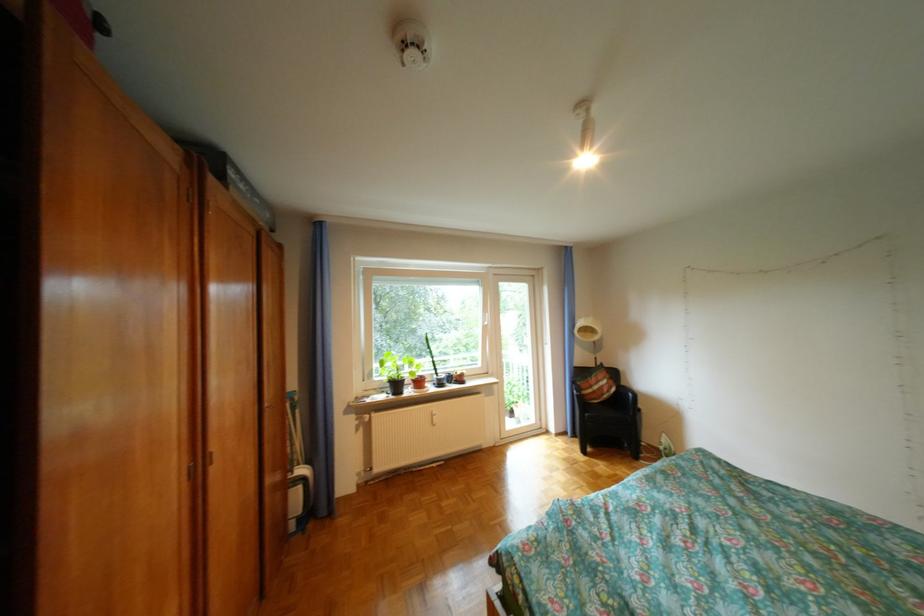
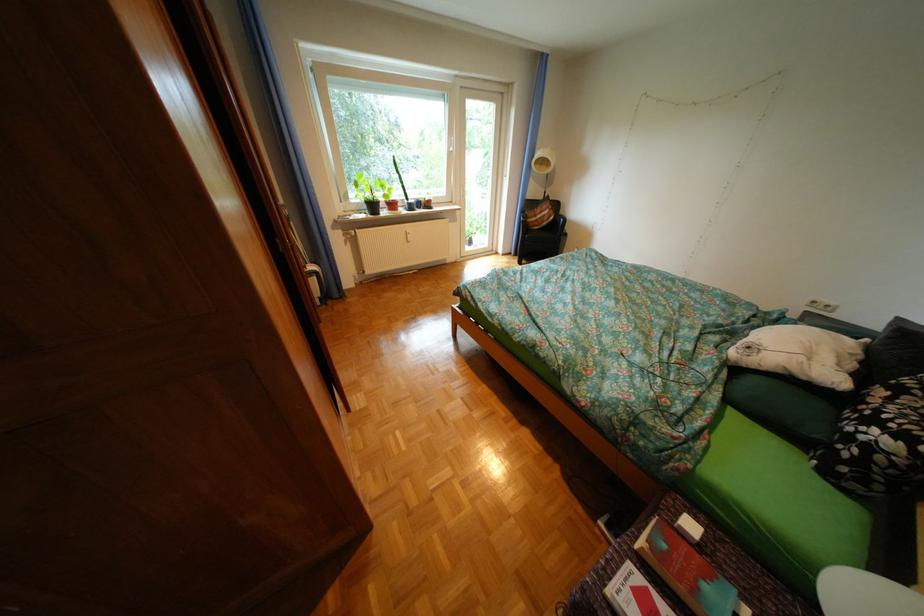
Where in the second image is the point corresponding to [410,386] from the first image?

(387, 207)